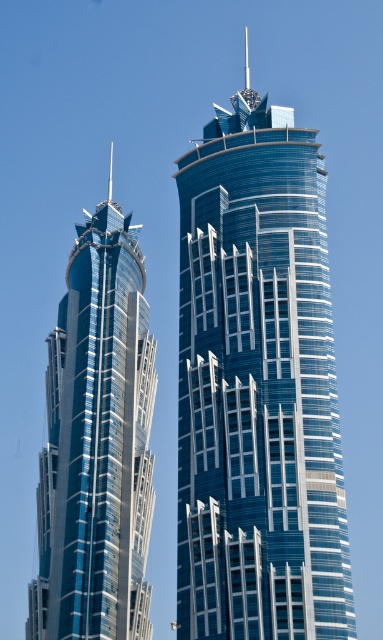
Is transparent glass tower at center smaller than glossy glass skyscraper at left?

Yes, transparent glass tower at center is smaller than glossy glass skyscraper at left.

Which is in front, point (286, 630) or point (134, 577)?

Point (286, 630) is more forward.

Locate an element on the screen. transparent glass tower at center is located at coordinates pos(258,387).